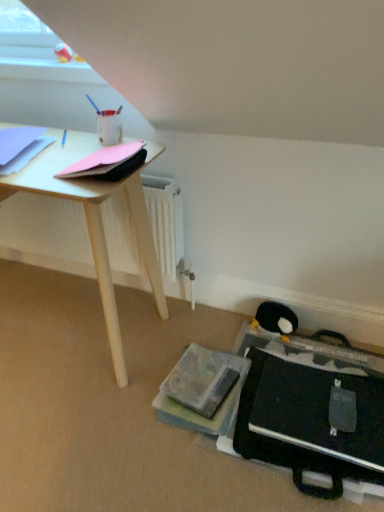
Image resolution: width=384 pixels, height=512 pixels. Describe the element at coordinates (20, 147) in the screenshot. I see `light blue paper at upper left, which is counted as the second paperback book, starting from the right` at that location.

This screenshot has height=512, width=384. I want to click on pink matte paper at upper left, which is the 2th paperback book from left to right, so click(102, 161).

Is light blue paper at upper left, which is the 1th paperback book in left-to-right order, located outside black plush penguin at lower right?

Indeed, light blue paper at upper left, which is the 1th paperback book in left-to-right order, is completely outside black plush penguin at lower right.

From the image's perspective, between light blue paper at upper left, which is the 1th paperback book in left-to-right order, and black plush penguin at lower right, who is located below?

From the image's view, black plush penguin at lower right is below.

Which object is positioned more to the right, light blue paper at upper left, which is counted as the second paperback book, starting from the right, or black plush penguin at lower right?

black plush penguin at lower right.

From a real-world perspective, which object stands above the other?

From a 3D spatial view, light blue paper at upper left, which is counted as the second paperback book, starting from the right, is above.

From the image's perspective, is black plush penguin at lower right positioned above or below light blue paper at upper left, which is counted as the second paperback book, starting from the right?

Based on their image positions, black plush penguin at lower right is located beneath light blue paper at upper left, which is counted as the second paperback book, starting from the right.

Locate an element on the screen. penguin that is behind the light blue paper at upper left, which is the 1th paperback book in left-to-right order is located at coordinates (275, 320).

Is black plush penguin at lower right far from light blue paper at upper left, which is the 1th paperback book in left-to-right order?

Yes, black plush penguin at lower right is far from light blue paper at upper left, which is the 1th paperback book in left-to-right order.

Which of these two, black plush penguin at lower right or light blue paper at upper left, which is counted as the second paperback book, starting from the right, stands taller?

With more height is black plush penguin at lower right.

From the image's perspective, is pink matte paper at upper left, which appears as the 1th paperback book when viewed from the right, above or below black plush penguin at lower right?

pink matte paper at upper left, which appears as the 1th paperback book when viewed from the right, is above black plush penguin at lower right.

Is pink matte paper at upper left, which is the 2th paperback book from left to right, facing towards black plush penguin at lower right?

No, pink matte paper at upper left, which is the 2th paperback book from left to right, is not aimed at black plush penguin at lower right.

Considering the sizes of objects pink matte paper at upper left, which is the 2th paperback book from left to right, and black plush penguin at lower right in the image provided, who is taller, pink matte paper at upper left, which is the 2th paperback book from left to right, or black plush penguin at lower right?

black plush penguin at lower right is taller.

Is the position of black plush penguin at lower right more distant than that of pink matte paper at upper left, which appears as the 1th paperback book when viewed from the right?

Yes, black plush penguin at lower right is further from the viewer.

Who is smaller, black plush penguin at lower right or pink matte paper at upper left, which is the 2th paperback book from left to right?

black plush penguin at lower right is smaller.

Is black plush penguin at lower right oriented away from pink matte paper at upper left, which is the 2th paperback book from left to right?

No, black plush penguin at lower right's orientation is not away from pink matte paper at upper left, which is the 2th paperback book from left to right.

Can you tell me how much black plush penguin at lower right and pink matte paper at upper left, which is the 2th paperback book from left to right, differ in facing direction?

0.298 degrees.

Consider the image. Is light blue paper at upper left, which is counted as the second paperback book, starting from the right, positioned with its back to pink matte paper at upper left, which appears as the 1th paperback book when viewed from the right?

light blue paper at upper left, which is counted as the second paperback book, starting from the right, is not turned away from pink matte paper at upper left, which appears as the 1th paperback book when viewed from the right.

Considering the positions of points (16, 140) and (114, 149), is point (16, 140) closer to camera compared to point (114, 149)?

No.

Does light blue paper at upper left, which is counted as the second paperback book, starting from the right, come behind pink matte paper at upper left, which is the 2th paperback book from left to right?

That is True.

Is light blue paper at upper left, which is counted as the second paperback book, starting from the right, wider or thinner than pink matte paper at upper left, which appears as the 1th paperback book when viewed from the right?

Considering their sizes, light blue paper at upper left, which is counted as the second paperback book, starting from the right, looks broader than pink matte paper at upper left, which appears as the 1th paperback book when viewed from the right.

Is pink matte paper at upper left, which is the 2th paperback book from left to right, directly adjacent to light blue paper at upper left, which is the 1th paperback book in left-to-right order?

No, pink matte paper at upper left, which is the 2th paperback book from left to right, is not beside light blue paper at upper left, which is the 1th paperback book in left-to-right order.

Where is `paperback book below the pink matte paper at upper left, which appears as the 1th paperback book when viewed from the right (from a real-world perspective)`? This screenshot has height=512, width=384. paperback book below the pink matte paper at upper left, which appears as the 1th paperback book when viewed from the right (from a real-world perspective) is located at coordinates (20, 147).

Could you tell me if pink matte paper at upper left, which is the 2th paperback book from left to right, is turned towards light blue paper at upper left, which is counted as the second paperback book, starting from the right?

No, pink matte paper at upper left, which is the 2th paperback book from left to right, does not turn towards light blue paper at upper left, which is counted as the second paperback book, starting from the right.

You are a GUI agent. You are given a task and a screenshot of the screen. Output one action in this format:
    pyautogui.click(x=<x>, y=<y>)
    Task: Click on the 1st paperback book in front of the black plush penguin at lower right
    The width and height of the screenshot is (384, 512).
    Given the screenshot: What is the action you would take?
    pyautogui.click(x=20, y=147)

Locate an element on the screen. The height and width of the screenshot is (512, 384). the 2nd paperback book above when counting from the black plush penguin at lower right (from the image's perspective) is located at coordinates (20, 147).

Based on their spatial positions, is black plush penguin at lower right or pink matte paper at upper left, which is the 2th paperback book from left to right, further from light blue paper at upper left, which is counted as the second paperback book, starting from the right?

black plush penguin at lower right.

Based on their spatial positions, is pink matte paper at upper left, which appears as the 1th paperback book when viewed from the right, or light blue paper at upper left, which is the 1th paperback book in left-to-right order, further from black plush penguin at lower right?

The object further to black plush penguin at lower right is light blue paper at upper left, which is the 1th paperback book in left-to-right order.

Considering their positions, is light blue paper at upper left, which is counted as the second paperback book, starting from the right, positioned further to black plush penguin at lower right than pink matte paper at upper left, which appears as the 1th paperback book when viewed from the right?

light blue paper at upper left, which is counted as the second paperback book, starting from the right.

Based on their spatial positions, is black plush penguin at lower right or light blue paper at upper left, which is the 1th paperback book in left-to-right order, further from pink matte paper at upper left, which is the 2th paperback book from left to right?

Based on the image, black plush penguin at lower right appears to be further to pink matte paper at upper left, which is the 2th paperback book from left to right.

Looking at this image, when comparing their distances from light blue paper at upper left, which is counted as the second paperback book, starting from the right, does pink matte paper at upper left, which appears as the 1th paperback book when viewed from the right, or black plush penguin at lower right seem closer?

Among the two, pink matte paper at upper left, which appears as the 1th paperback book when viewed from the right, is located nearer to light blue paper at upper left, which is counted as the second paperback book, starting from the right.

Estimate the real-world distances between objects in this image. Which object is further from pink matte paper at upper left, which appears as the 1th paperback book when viewed from the right, light blue paper at upper left, which is the 1th paperback book in left-to-right order, or black plush penguin at lower right?

The object further to pink matte paper at upper left, which appears as the 1th paperback book when viewed from the right, is black plush penguin at lower right.

Locate an element on the screen. paperback book located between light blue paper at upper left, which is the 1th paperback book in left-to-right order, and black plush penguin at lower right in the left-right direction is located at coordinates (102, 161).